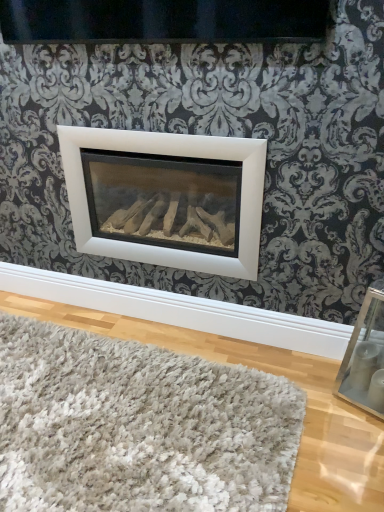
At what (x,y) coordinates should I click in order to perform the action: click on vacant region to the left of clear glass picture frame at lower right. Please return your answer as a coordinate pair (x, y). This screenshot has height=512, width=384. Looking at the image, I should click on (311, 394).